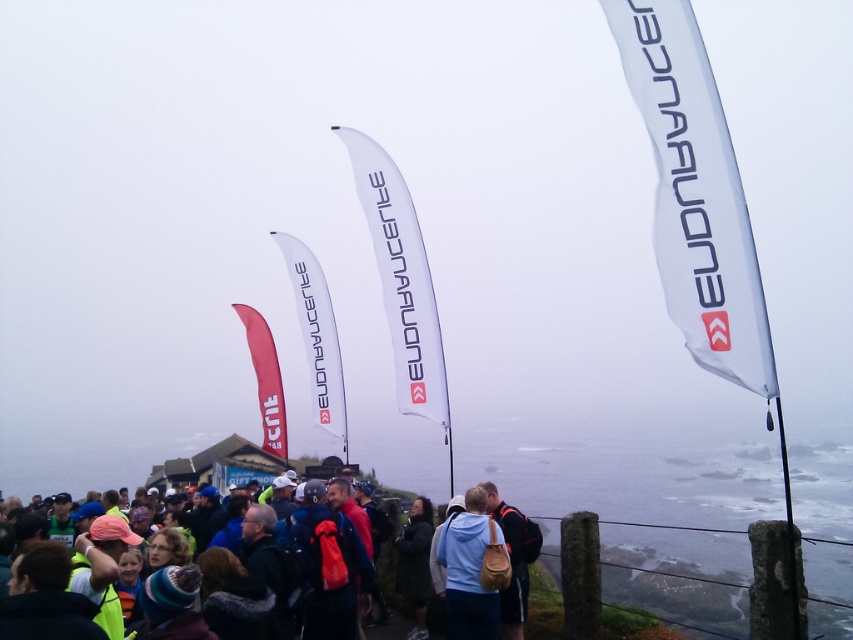
You are organizing a group photo and need to arrange two people wearing light blue jackets. The first person is wearing a light blue fabric jacket at center, and the second is wearing a light blue jacket at center. Which jacket has a wider width?

The light blue fabric jacket at center has a wider width than the light blue jacket at center according to the description.

You are a photographer trying to capture a candid shot of the light blue fabric jacket at center and the light blue jacket at center in the crowd. Since you want both subjects to be in focus, what is the minimum distance you should set your camera lens to focus on?

The distance between the light blue fabric jacket at center and the light blue jacket at center is 8.01 inches, so you should set the camera lens to focus at least 8.01 inches away to ensure both are in focus.